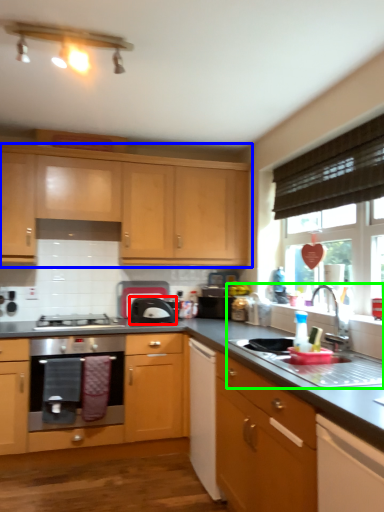
Question: Which object is the farthest from kitchen appliance (highlighted by a red box)? Choose among these: cabinetry (highlighted by a blue box) or sink (highlighted by a green box).

Choices:
 (A) cabinetry
 (B) sink

Answer: (B)